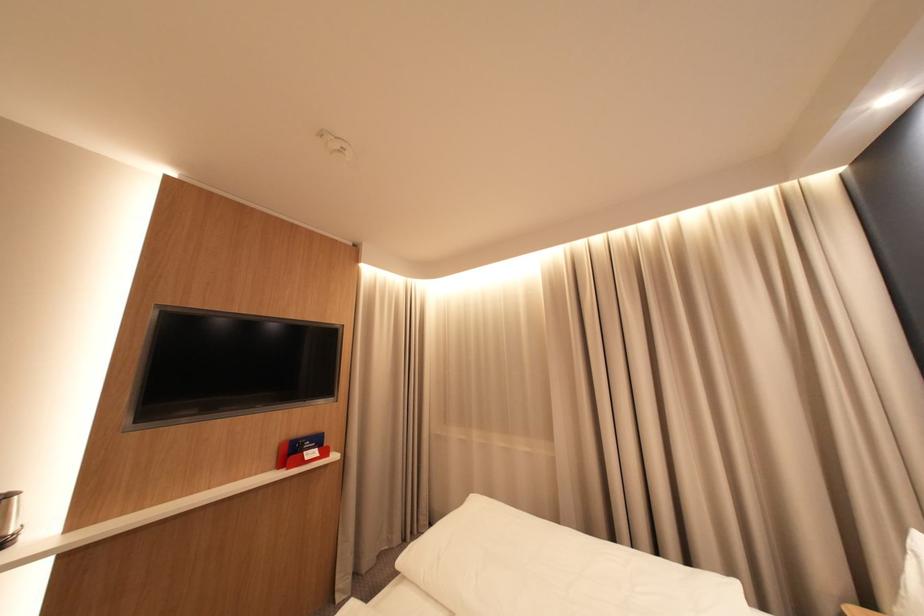
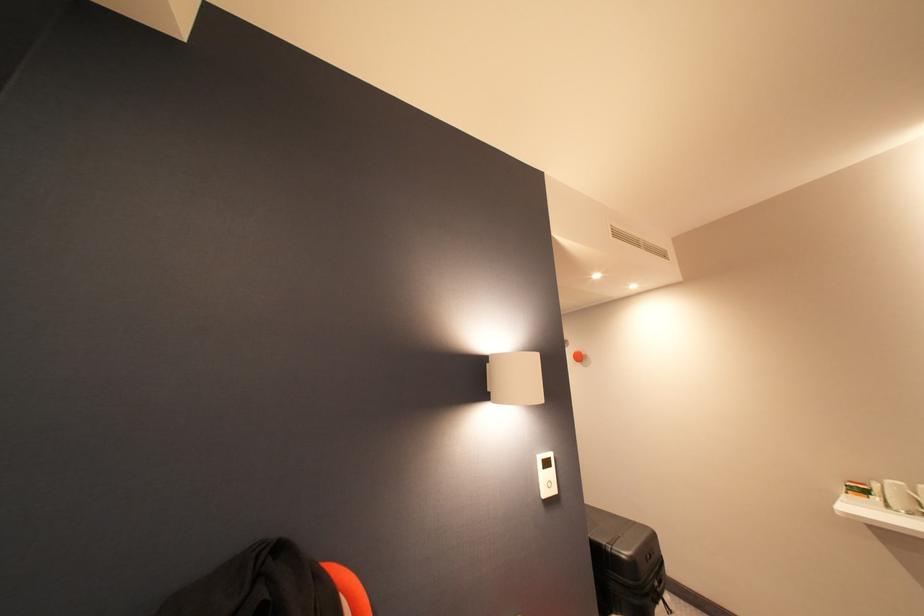
How did the camera likely rotate?

The camera's rotation is toward left-up.